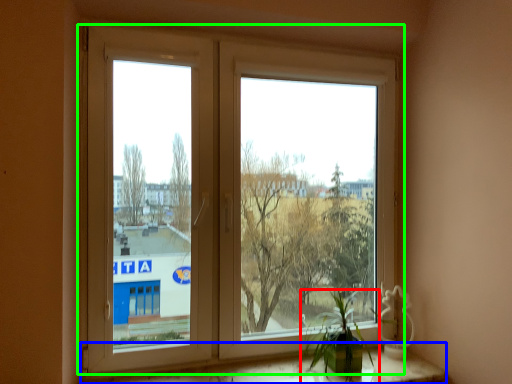
Question: Considering the real-world distances, which object is closest to houseplant (highlighted by a red box)? window sill (highlighted by a blue box) or window (highlighted by a green box).

Choices:
 (A) window sill
 (B) window

Answer: (A)